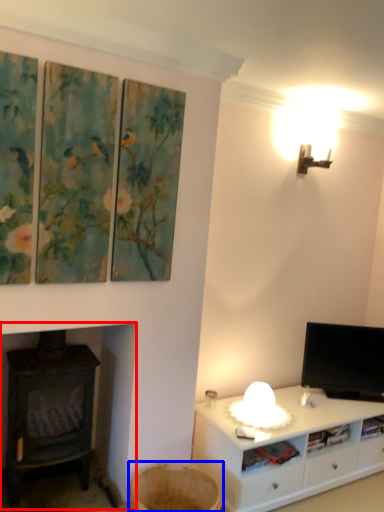
Question: Which object appears farthest to the camera in this image, wood burning stove (highlighted by a red box) or basket (highlighted by a blue box)?

Choices:
 (A) wood burning stove
 (B) basket

Answer: (A)